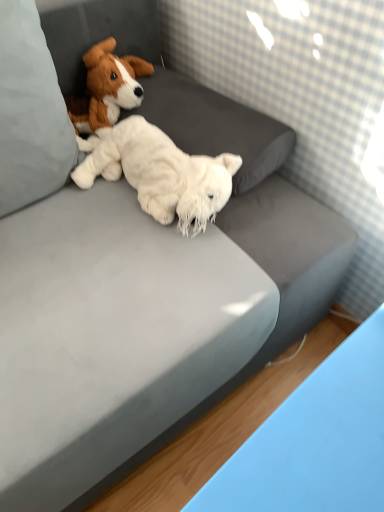
Question: Is white soft pillow at upper left wider or thinner than white fluffy stuffed animal at center, the second dog when ordered from top to bottom?

Choices:
 (A) wide
 (B) thin

Answer: (A)

Question: In the image, is white soft pillow at upper left positioned in front of or behind white fluffy stuffed animal at center, the second dog when ordered from top to bottom?

Choices:
 (A) behind
 (B) front

Answer: (B)

Question: Which of these objects is positioned closest to the white soft pillow at upper left?

Choices:
 (A) brown plush dog at upper left, placed as the 2th dog when sorted from bottom to top
 (B) white fluffy stuffed animal at center, the second dog when ordered from top to bottom

Answer: (B)

Question: Which is nearer to the white soft pillow at upper left?

Choices:
 (A) white fluffy stuffed animal at center, the second dog when ordered from top to bottom
 (B) brown plush dog at upper left, placed as the 2th dog when sorted from bottom to top

Answer: (A)